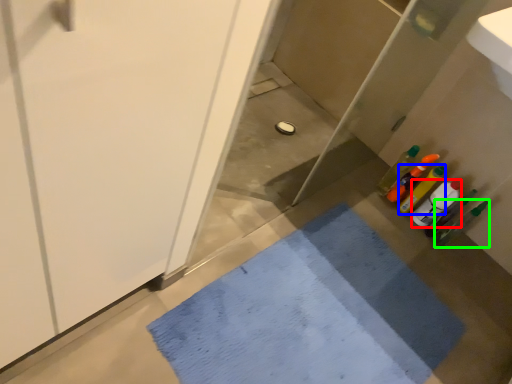
Question: Which object is positioned farthest from bottle (highlighted by a red box)? Select from bottle (highlighted by a blue box) and bottle (highlighted by a green box).

Choices:
 (A) bottle
 (B) bottle

Answer: (B)